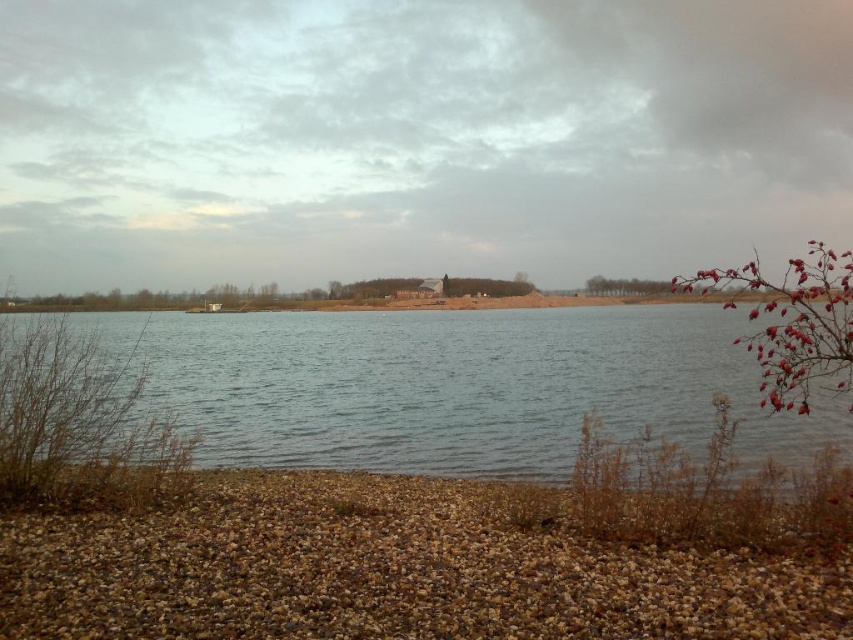
Question: Which object appears farthest from the camera in this image?

Choices:
 (A) brown gravel at lower left
 (B) clear water at center

Answer: (A)

Question: Can you confirm if brown gravel at lower left is positioned above clear water at center?

Choices:
 (A) yes
 (B) no

Answer: (B)

Question: Which point appears farthest from the camera in this image?

Choices:
 (A) (199, 337)
 (B) (775, 563)

Answer: (A)

Question: Which point is farther to the camera?

Choices:
 (A) (167, 538)
 (B) (404, 326)

Answer: (B)

Question: Can you confirm if brown gravel at lower left is positioned above clear water at center?

Choices:
 (A) no
 (B) yes

Answer: (A)

Question: Does brown gravel at lower left appear under clear water at center?

Choices:
 (A) no
 (B) yes

Answer: (B)